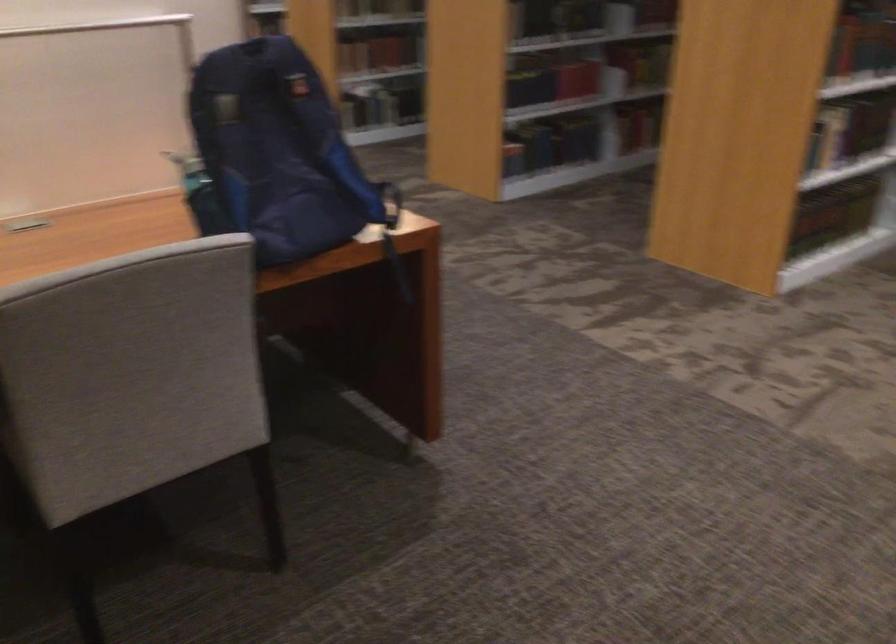
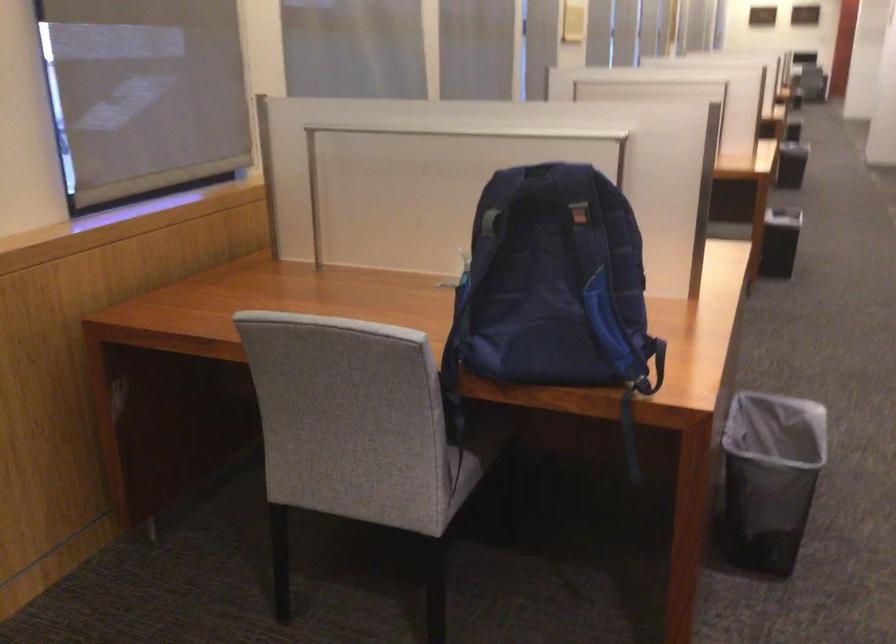
In the second image, find the point that corresponds to point 289,160 in the first image.

(552, 281)